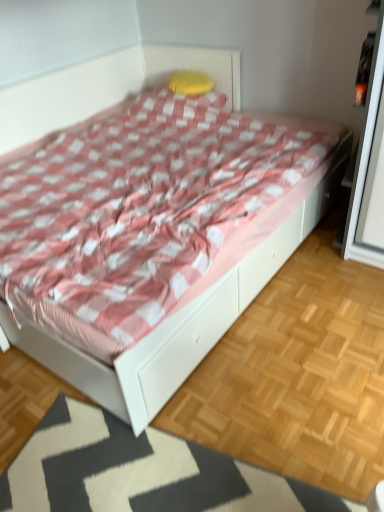
Question: In terms of size, does yellow fabric pillow at upper center appear bigger or smaller than white textured mat at lower center?

Choices:
 (A) small
 (B) big

Answer: (A)

Question: From the image's perspective, relative to white textured mat at lower center, is yellow fabric pillow at upper center above or below?

Choices:
 (A) above
 (B) below

Answer: (A)

Question: Which object is the farthest from the white textured mat at lower center?

Choices:
 (A) white glossy bed at center
 (B) yellow fabric pillow at upper center

Answer: (B)

Question: Which is nearer to the white glossy bed at center?

Choices:
 (A) yellow fabric pillow at upper center
 (B) white textured mat at lower center

Answer: (B)